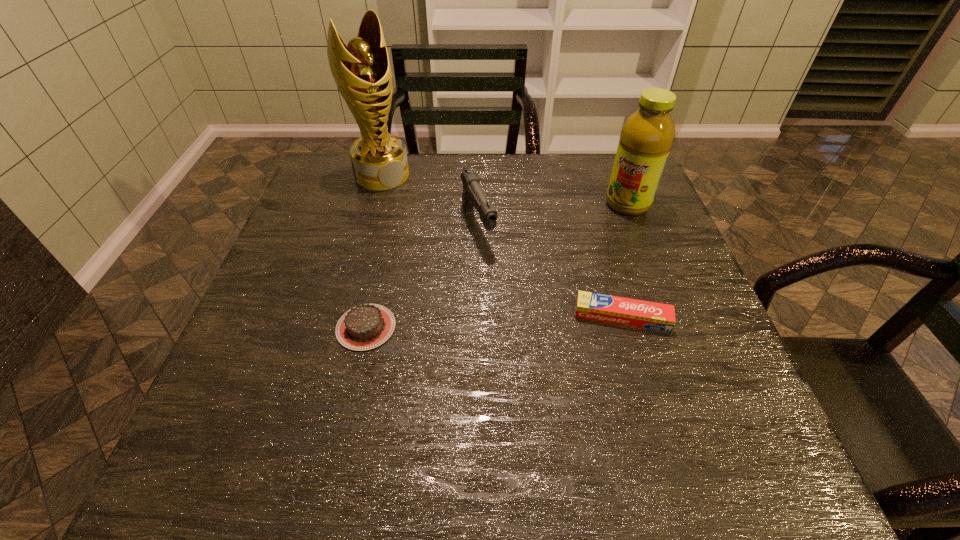
At what (x,y) coordinates should I click in order to perform the action: click on vacant spot on the desktop that is between the chocolate cake and the toothpaste and is positioned on the front-facing side of the award. Please return your answer as a coordinate pair (x, y). The height and width of the screenshot is (540, 960). Looking at the image, I should click on (529, 320).

Locate an element on the screen. vacant space on the desktop that is between the chocolate cake and the toothpaste and is positioned in the direction the third object from left to right is aimed is located at coordinates (525, 321).

You are a GUI agent. You are given a task and a screenshot of the screen. Output one action in this format:
    pyautogui.click(x=<x>, y=<y>)
    Task: Click on the free space on the desktop that is between the chocolate cake and the toothpaste and is positioned on the front label of the second tallest object
    The image size is (960, 540).
    Given the screenshot: What is the action you would take?
    514,321